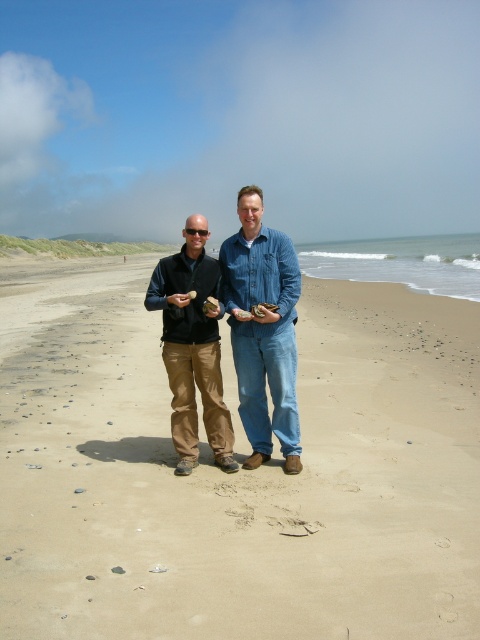
Can you confirm if smooth sand at center is taller than khaki cotton pants at center?

Indeed, smooth sand at center has a greater height compared to khaki cotton pants at center.

Between point (116, 609) and point (210, 349), which one is positioned in front?

Point (116, 609)

Locate an element on the screen. Image resolution: width=480 pixels, height=640 pixels. smooth sand at center is located at coordinates (235, 474).

Who is taller, smooth sand at center or denim jeans at center?

smooth sand at center is taller.

Find the location of `smooth sand at center`. smooth sand at center is located at coordinates (235, 474).

What do you see at coordinates (235, 474) in the screenshot? The width and height of the screenshot is (480, 640). I see `smooth sand at center` at bounding box center [235, 474].

Locate an element on the screen. This screenshot has width=480, height=640. smooth sand at center is located at coordinates (235, 474).

Does denim jeans at center appear on the left side of khaki cotton pants at center?

Incorrect, denim jeans at center is not on the left side of khaki cotton pants at center.

Describe the element at coordinates (263, 330) in the screenshot. I see `denim jeans at center` at that location.

From the picture: Who is more forward, (263, 416) or (180, 433)?

Positioned in front is point (180, 433).

Find the location of a particular element. denim jeans at center is located at coordinates (263, 330).